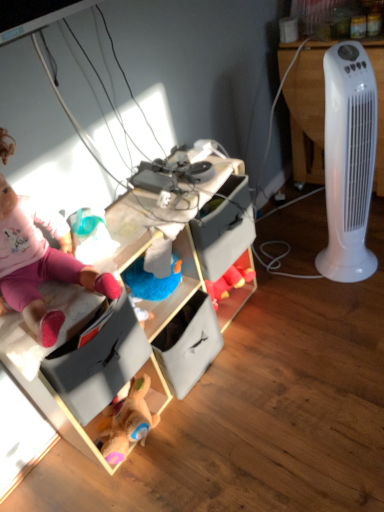
The image size is (384, 512). Identify the location of vacant point to the left of white plastic tower fan at right. (299, 282).